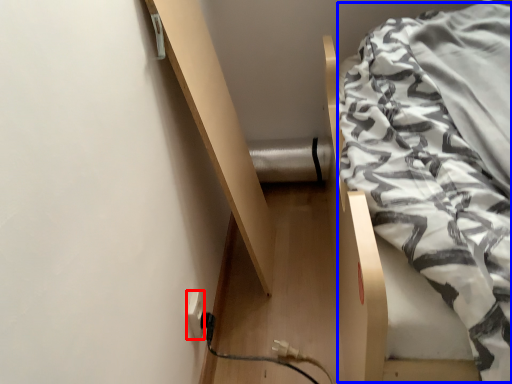
Question: Among these objects, which one is farthest to the camera, electric outlet (highlighted by a red box) or blanket (highlighted by a blue box)?

Choices:
 (A) electric outlet
 (B) blanket

Answer: (A)